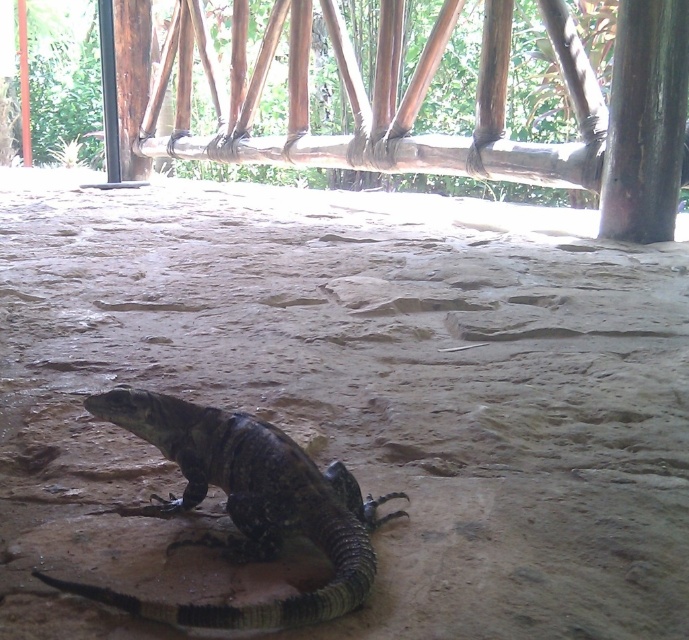
How distant is brown sandy ground at center from dark gray scaly lizard at center?

They are 31.05 inches apart.

Does brown sandy ground at center have a larger size compared to dark gray scaly lizard at center?

Indeed, brown sandy ground at center has a larger size compared to dark gray scaly lizard at center.

Between point (568, 282) and point (296, 486), which one is positioned in front?

Point (296, 486)

Where is `brown sandy ground at center`? brown sandy ground at center is located at coordinates (349, 401).